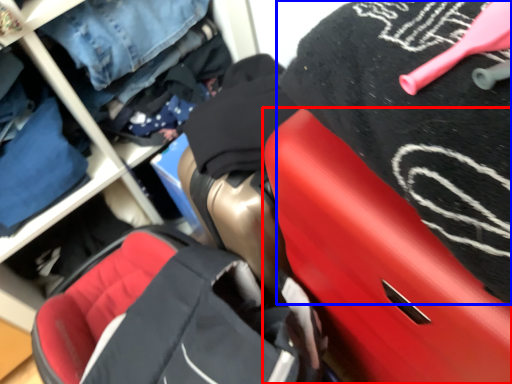
Question: Which point is closer to the camera, luggage (highlighted by a red box) or clothing (highlighted by a blue box)?

Choices:
 (A) luggage
 (B) clothing

Answer: (B)